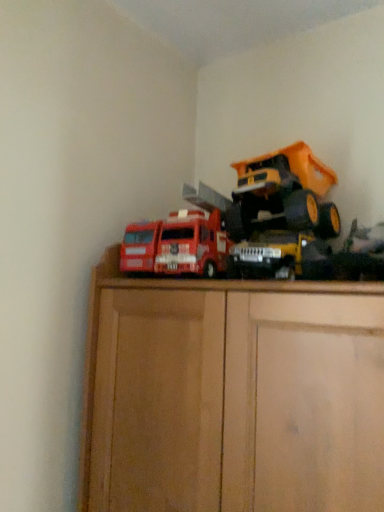
Question: In which direction should I rotate to look at metallic yellow truck at center, the 2th toy in the right-to-left sequence?

Choices:
 (A) right
 (B) left

Answer: (A)

Question: From a real-world perspective, is metallic yellow dump truck at upper right, which ranks as the 1th toy in right-to-left order, positioned under metallic yellow truck at center, marked as the 2th toy in a left-to-right arrangement, based on gravity?

Choices:
 (A) yes
 (B) no

Answer: (B)

Question: From a real-world perspective, is metallic yellow dump truck at upper right, which appears as the 3th toy when viewed from the left, positioned over metallic yellow truck at center, marked as the 2th toy in a left-to-right arrangement, based on gravity?

Choices:
 (A) yes
 (B) no

Answer: (A)

Question: Does metallic yellow dump truck at upper right, which ranks as the 1th toy in right-to-left order, have a greater height compared to metallic yellow truck at center, marked as the 2th toy in a left-to-right arrangement?

Choices:
 (A) no
 (B) yes

Answer: (B)

Question: Is metallic yellow dump truck at upper right, which appears as the 3th toy when viewed from the left, shorter than metallic yellow truck at center, marked as the 2th toy in a left-to-right arrangement?

Choices:
 (A) no
 (B) yes

Answer: (A)

Question: Is metallic yellow dump truck at upper right, which appears as the 3th toy when viewed from the left, positioned behind metallic yellow truck at center, marked as the 2th toy in a left-to-right arrangement?

Choices:
 (A) yes
 (B) no

Answer: (A)

Question: Is metallic yellow dump truck at upper right, which ranks as the 1th toy in right-to-left order, wider than metallic yellow truck at center, marked as the 2th toy in a left-to-right arrangement?

Choices:
 (A) yes
 (B) no

Answer: (A)

Question: Is metallic yellow truck at center, marked as the 2th toy in a left-to-right arrangement, at the right side of metallic yellow dump truck at upper right, which ranks as the 1th toy in right-to-left order?

Choices:
 (A) yes
 (B) no

Answer: (B)

Question: Considering the relative sizes of metallic yellow truck at center, marked as the 2th toy in a left-to-right arrangement, and metallic yellow dump truck at upper right, which ranks as the 1th toy in right-to-left order, in the image provided, is metallic yellow truck at center, marked as the 2th toy in a left-to-right arrangement, wider than metallic yellow dump truck at upper right, which ranks as the 1th toy in right-to-left order,?

Choices:
 (A) yes
 (B) no

Answer: (B)

Question: Is metallic yellow dump truck at upper right, which appears as the 3th toy when viewed from the left, surrounded by metallic yellow truck at center, the 2th toy in the right-to-left sequence?

Choices:
 (A) yes
 (B) no

Answer: (B)

Question: Considering the relative sizes of metallic yellow truck at center, the 2th toy in the right-to-left sequence, and metallic yellow dump truck at upper right, which appears as the 3th toy when viewed from the left, in the image provided, is metallic yellow truck at center, the 2th toy in the right-to-left sequence, bigger than metallic yellow dump truck at upper right, which appears as the 3th toy when viewed from the left,?

Choices:
 (A) yes
 (B) no

Answer: (B)

Question: Can you confirm if metallic yellow truck at center, the 2th toy in the right-to-left sequence, is thinner than metallic yellow dump truck at upper right, which ranks as the 1th toy in right-to-left order?

Choices:
 (A) yes
 (B) no

Answer: (A)

Question: Is metallic yellow truck at center, marked as the 2th toy in a left-to-right arrangement, closer to the viewer compared to metallic yellow dump truck at upper right, which ranks as the 1th toy in right-to-left order?

Choices:
 (A) yes
 (B) no

Answer: (A)

Question: From the image's perspective, would you say metallic yellow truck at center, the 2th toy in the right-to-left sequence, is shown under matte red truck at center, which is the 1th toy from left to right?

Choices:
 (A) no
 (B) yes

Answer: (B)